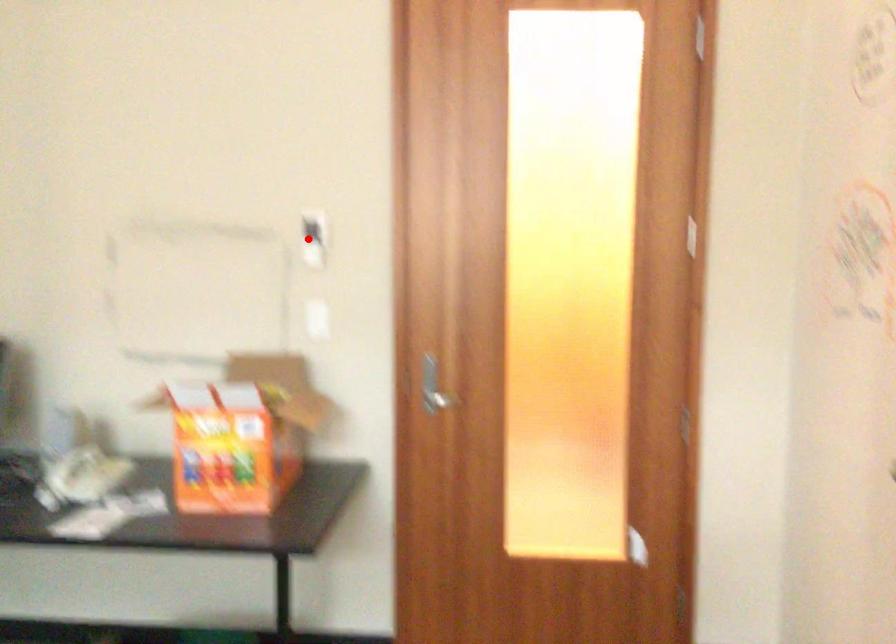
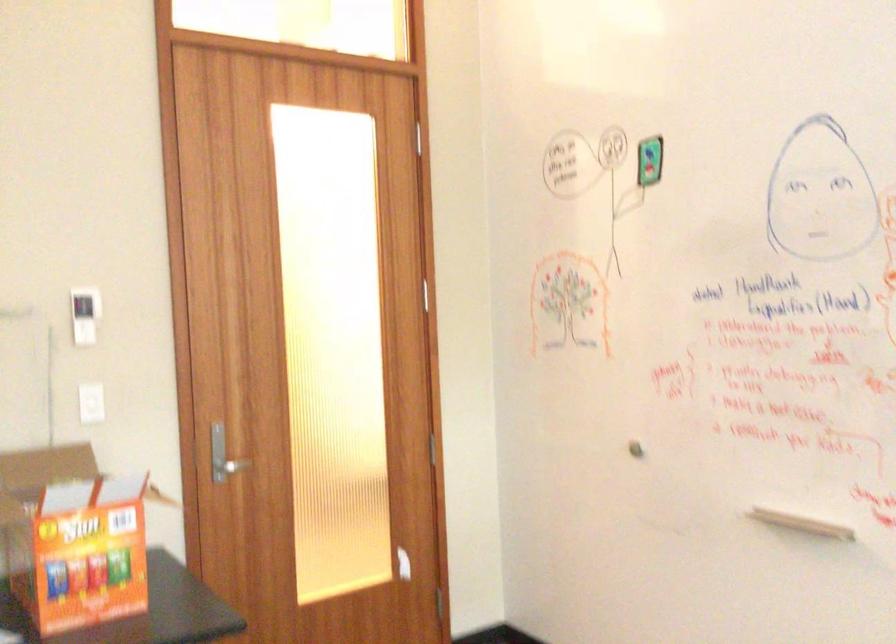
Locate, in the second image, the point that corresponds to the highlighted location in the first image.

(84, 315)